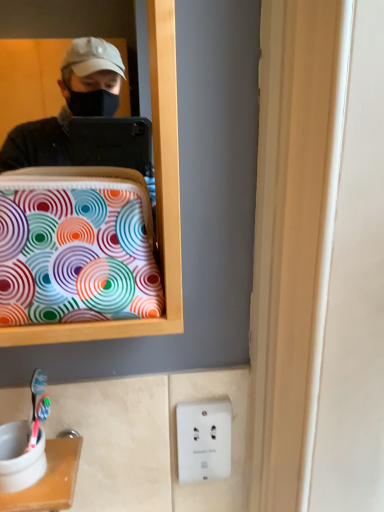
Question: Can you confirm if colorful fabric bag at left is positioned to the right of white plastic toothbrush holder at lower left?

Choices:
 (A) no
 (B) yes

Answer: (B)

Question: Does colorful fabric bag at left lie in front of white plastic toothbrush holder at lower left?

Choices:
 (A) no
 (B) yes

Answer: (B)

Question: Is there a large distance between colorful fabric bag at left and white plastic toothbrush holder at lower left?

Choices:
 (A) no
 (B) yes

Answer: (A)

Question: Does colorful fabric bag at left contain white plastic toothbrush holder at lower left?

Choices:
 (A) yes
 (B) no

Answer: (B)

Question: From the image's perspective, is colorful fabric bag at left over white plastic toothbrush holder at lower left?

Choices:
 (A) no
 (B) yes

Answer: (B)

Question: In terms of width, does white plastic toothbrush holder at lower left look wider or thinner when compared to white plastic electric outlet at lower center?

Choices:
 (A) wide
 (B) thin

Answer: (A)

Question: From the image's perspective, is white plastic toothbrush holder at lower left located above or below white plastic electric outlet at lower center?

Choices:
 (A) below
 (B) above

Answer: (B)

Question: From a real-world perspective, is white plastic toothbrush holder at lower left positioned above or below white plastic electric outlet at lower center?

Choices:
 (A) above
 (B) below

Answer: (A)

Question: Does point (61, 497) appear closer or farther from the camera than point (216, 430)?

Choices:
 (A) closer
 (B) farther

Answer: (A)

Question: In the image, is colorful fabric bag at left positioned in front of or behind white plastic toothbrush holder at lower left?

Choices:
 (A) front
 (B) behind

Answer: (A)

Question: From a real-world perspective, is colorful fabric bag at left above or below white plastic toothbrush holder at lower left?

Choices:
 (A) above
 (B) below

Answer: (A)

Question: Based on their sizes in the image, would you say colorful fabric bag at left is bigger or smaller than white plastic toothbrush holder at lower left?

Choices:
 (A) big
 (B) small

Answer: (A)

Question: In terms of height, does colorful fabric bag at left look taller or shorter compared to white plastic toothbrush holder at lower left?

Choices:
 (A) short
 (B) tall

Answer: (B)

Question: Considering their positions, is white plastic toothbrush holder at lower left located in front of or behind colorful fabric bag at left?

Choices:
 (A) behind
 (B) front

Answer: (A)

Question: Is white plastic toothbrush holder at lower left situated inside colorful fabric bag at left or outside?

Choices:
 (A) outside
 (B) inside

Answer: (A)